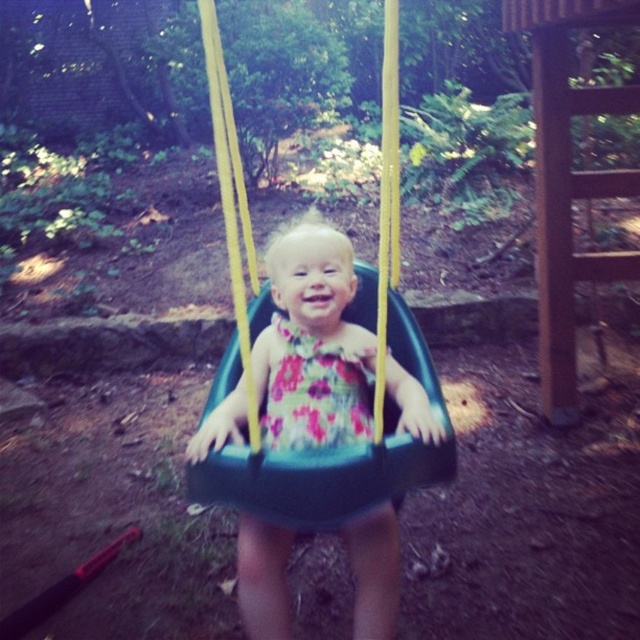
Question: Among these objects, which one is farthest from the camera?

Choices:
 (A) floral fabric dress at center
 (B) black plastic swing at center

Answer: (A)

Question: Does black plastic swing at center have a smaller size compared to floral fabric dress at center?

Choices:
 (A) no
 (B) yes

Answer: (A)

Question: Is floral dress at center thinner than floral fabric dress at center?

Choices:
 (A) no
 (B) yes

Answer: (A)

Question: Among these points, which one is nearest to the camera?

Choices:
 (A) (346, 381)
 (B) (380, 236)
 (C) (342, 433)

Answer: (B)

Question: Can you confirm if floral dress at center is positioned to the right of floral fabric dress at center?

Choices:
 (A) yes
 (B) no

Answer: (A)

Question: Which point is closer to the camera taking this photo?

Choices:
 (A) (326, 257)
 (B) (237, 282)

Answer: (B)